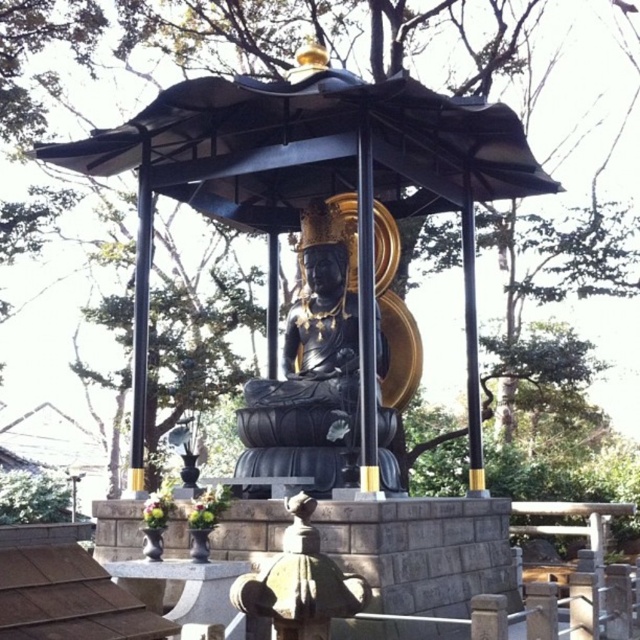
You are standing at the entrance of the pavilion facing the Buddha statue. There are two points marked in the scene, point (368, 260) and point (134, 248). Which point is closer to you?

Point (134, 248) is closer to you because it is behind point (368, 260). Since point (368, 260) is in front of point (134, 248), the latter is farther away from your current position at the entrance.

You are a visitor standing at the entrance of the pavilion and want to place a 5 feet long decorative banner between the black polished statue at center and the black polished pole at left. Can the banner fit between them without overlapping either object?

The distance between the black polished statue at center and the black polished pole at left is 5.39 feet. Since the banner is 5 feet long, it can fit between them without overlapping either object as there is enough space.